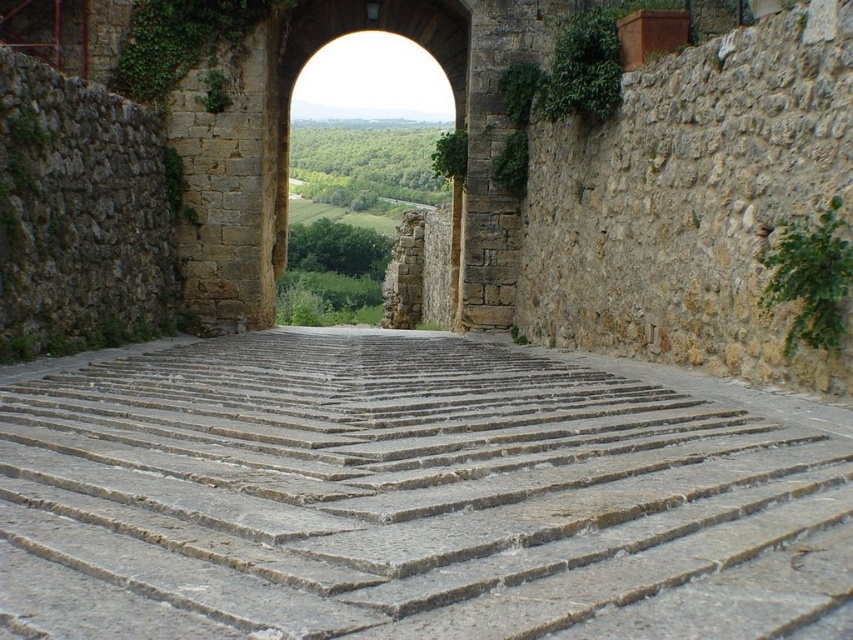
Is stone archway at center thinner than green leafy ivy at right?

No, stone archway at center is not thinner than green leafy ivy at right.

Between stone archway at center and green leafy ivy at right, which one has more height?

stone archway at center

Locate an element on the screen. The height and width of the screenshot is (640, 853). stone archway at center is located at coordinates (344, 35).

Which is more to the left, gray stone stairs at center or stone archway at center?

stone archway at center

Who is shorter, gray stone stairs at center or stone archway at center?

gray stone stairs at center

Does point (753, 556) lie in front of point (451, 54)?

Yes, it is in front of point (451, 54).

Find the location of a particular element. Image resolution: width=853 pixels, height=640 pixels. gray stone stairs at center is located at coordinates (410, 496).

Is gray stone stairs at center taller than green leafy ivy at right?

Correct, gray stone stairs at center is much taller as green leafy ivy at right.

From the picture: How much distance is there between gray stone stairs at center and green leafy ivy at right?

The distance of gray stone stairs at center from green leafy ivy at right is 22.43 meters.

Is point (172, 360) positioned before point (808, 240)?

No, it is behind (808, 240).

You are a GUI agent. You are given a task and a screenshot of the screen. Output one action in this format:
    pyautogui.click(x=<x>, y=<y>)
    Task: Click on the gray stone stairs at center
    Image resolution: width=853 pixels, height=640 pixels.
    Given the screenshot: What is the action you would take?
    pyautogui.click(x=410, y=496)